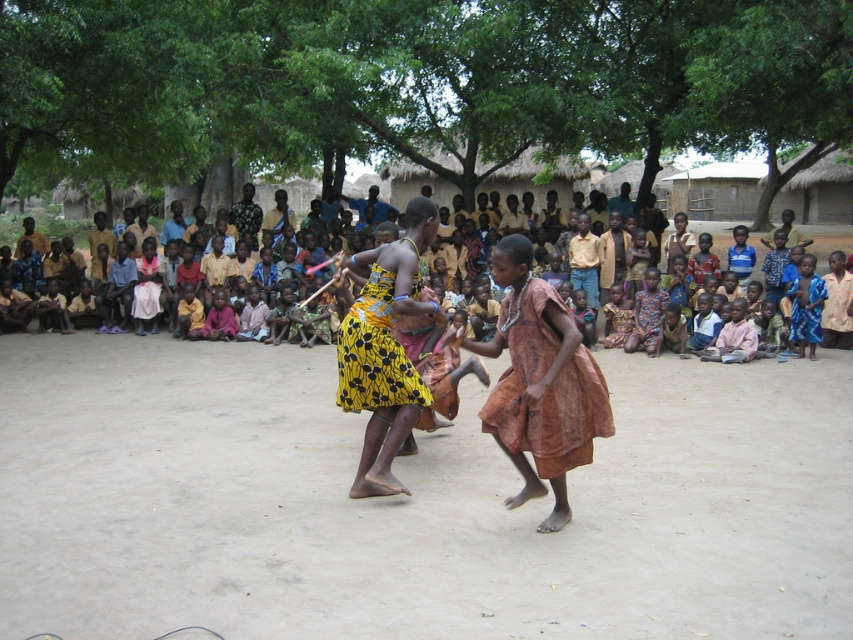
Based on the scene description, which object is positioned lower in the image? The yellow printed dress at center or the yellow printed fabric dress at center?

The yellow printed dress at center is positioned below the yellow printed fabric dress at center, so it is lower in the image.

You are a photographer standing in the middle of the scene. You want to take a photo of both point (392, 380) and point (376, 364). Which point is closer to you?

Point (376, 364) is closer to you because it is less further than point (392, 380).

You are a photographer trying to capture both the brown fabric dress at center and the yellow printed dress at center in a single frame. Given that your camera has a fixed focal length, which dress should you focus on to ensure both are fully visible without cropping?

You should focus on the brown fabric dress at center because its width is greater than the yellow printed dress at center, so prioritizing it ensures both will fit within the frame.